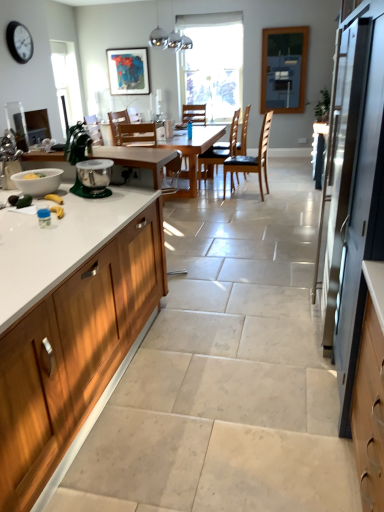
This screenshot has height=512, width=384. Describe the element at coordinates (244, 134) in the screenshot. I see `wooden chair at center, the second chair in the back-to-front sequence` at that location.

In order to face brown leather chair at center, the fourth chair viewed from the back, should I rotate leftwards or rightwards?

You should look right and rotate roughly 7.357 degrees.

I want to click on matte plastic picture frame at upper center, so click(128, 71).

Describe the element at coordinates (128, 71) in the screenshot. I see `matte plastic picture frame at upper center` at that location.

This screenshot has width=384, height=512. I want to click on wooden chair at center, the second chair in the back-to-front sequence, so click(244, 134).

How different are the orientations of wooden chair at center, the second chair in the back-to-front sequence, and satin silver refrigerator at right in degrees?

2 degrees.

Based on the photo, from the image's perspective, between wooden chair at center, the second chair in the back-to-front sequence, and satin silver refrigerator at right, who is located below?

satin silver refrigerator at right.

How much distance is there between wooden chair at center, which ranks as the fourth chair in front-to-back order, and satin silver refrigerator at right?

wooden chair at center, which ranks as the fourth chair in front-to-back order, is 4.15 meters away from satin silver refrigerator at right.

I want to click on the 4th chair behind the satin silver refrigerator at right, counting from the anchor's position, so click(x=244, y=134).

Is green plastic stand mixer at left in front of or behind matte plastic picture frame at upper center in the image?

In the image, green plastic stand mixer at left appears in front of matte plastic picture frame at upper center.

Between green plastic stand mixer at left and matte plastic picture frame at upper center, which one has smaller size?

With smaller size is matte plastic picture frame at upper center.

Is matte plastic picture frame at upper center at the back of green plastic stand mixer at left?

That's not correct — green plastic stand mixer at left is not looking away from matte plastic picture frame at upper center.

Considering the relative sizes of wooden cabinet at left and matte plastic picture frame at upper center in the image provided, is wooden cabinet at left shorter than matte plastic picture frame at upper center?

In fact, wooden cabinet at left may be taller than matte plastic picture frame at upper center.

Is wooden cabinet at left thinner than matte plastic picture frame at upper center?

No.

Is wooden cabinet at left looking in the opposite direction of matte plastic picture frame at upper center?

Yes, wooden cabinet at left's orientation is away from matte plastic picture frame at upper center.

Does wooden chair at center, which is the first chair in front-to-back order, have a greater width compared to light wood table at center?

No, wooden chair at center, which is the first chair in front-to-back order, is not wider than light wood table at center.

From the picture: Is wooden chair at center, the fifth chair when ordered from back to front, smaller than light wood table at center?

Yes.

Is wooden chair at center, which is the first chair in front-to-back order, with light wood table at center?

There is a gap between wooden chair at center, which is the first chair in front-to-back order, and light wood table at center.

In order to click on the 2nd chair below the wooden chair at center, which is counted as the 3th chair, starting from the back (from the image's perspective) in this screenshot , I will do `click(146, 150)`.

From the image's perspective, is wooden chair at center, which is counted as the 3th chair, starting from the front, located above wooden chair at center, which is the first chair in front-to-back order?

Yes, from the image's perspective, wooden chair at center, which is counted as the 3th chair, starting from the front, is over wooden chair at center, which is the first chair in front-to-back order.

Considering the relative positions of wooden chair at center, which is counted as the 3th chair, starting from the front, and wooden chair at center, which is the first chair in front-to-back order, in the image provided, is wooden chair at center, which is counted as the 3th chair, starting from the front, to the left or to the right of wooden chair at center, which is the first chair in front-to-back order,?

In the image, wooden chair at center, which is counted as the 3th chair, starting from the front, appears on the right side of wooden chair at center, which is the first chair in front-to-back order.

In the image, is wooden chair at center, which ranks as the fourth chair in front-to-back order, positioned in front of or behind transparent glass window at center?

wooden chair at center, which ranks as the fourth chair in front-to-back order, is in front of transparent glass window at center.

Does wooden chair at center, which ranks as the fourth chair in front-to-back order, have a lesser width compared to transparent glass window at center?

Incorrect, the width of wooden chair at center, which ranks as the fourth chair in front-to-back order, is not less than that of transparent glass window at center.

Does wooden chair at center, the second chair in the back-to-front sequence, turn towards transparent glass window at center?

No, wooden chair at center, the second chair in the back-to-front sequence, is not aimed at transparent glass window at center.

How distant is wooden chair at center, the second chair in the back-to-front sequence, from transparent glass window at center?

36.86 inches.

Find the location of a particular element. table lying on the left of transparent glass window at center is located at coordinates (192, 153).

Is light wood table at center inside transparent glass window at center?

No, light wood table at center is not inside transparent glass window at center.

Looking at this image, how different are the orientations of transparent glass window at center and light wood table at center in degrees?

transparent glass window at center and light wood table at center are facing 0.36 degrees away from each other.

Is transparent glass window at center taller or shorter than light wood table at center?

Considering their sizes, transparent glass window at center has more height than light wood table at center.

From the image's perspective, starting from the satin silver refrigerator at right, which chair is the 4th one above? Please provide its 2D coordinates.

[(244, 134)]

The image size is (384, 512). I want to click on picture frame to the left of green plastic stand mixer at left, so click(x=128, y=71).

Which object lies further to the anchor point clear glass window screen at upper right, wooden cabinet at left or satin silver refrigerator at right?

Based on the image, wooden cabinet at left appears to be further to clear glass window screen at upper right.

Looking at the image, which one is located further to wooden chair at center, which is the first chair in front-to-back order, clear glass window screen at upper right or wooden chair at center, which ranks as the fourth chair in front-to-back order?

Based on the image, clear glass window screen at upper right appears to be further to wooden chair at center, which is the first chair in front-to-back order.

Estimate the real-world distances between objects in this image. Which object is further from light wood table at center, black plastic clock at upper left or wooden chair at center, arranged as the 5th chair when viewed from the front?

black plastic clock at upper left lies further to light wood table at center than the other object.

Estimate the real-world distances between objects in this image. Which object is closer to wooden cabinet at left, satin silver refrigerator at right or brown leather chair at center, the fourth chair viewed from the back?

The object closer to wooden cabinet at left is satin silver refrigerator at right.

Which object lies nearer to the anchor point green plastic stand mixer at left, wooden chair at center, which is the first chair in front-to-back order, or black plastic clock at upper left?

wooden chair at center, which is the first chair in front-to-back order.

Estimate the real-world distances between objects in this image. Which object is further from black plastic clock at upper left, brown leather chair at center, arranged as the 2th chair when viewed from the front, or wooden chair at center, the first chair positioned from the back?

brown leather chair at center, arranged as the 2th chair when viewed from the front, lies further to black plastic clock at upper left than the other object.

Estimate the real-world distances between objects in this image. Which object is closer to satin silver refrigerator at right, white glossy bowl at left or light wood table at center?

white glossy bowl at left lies closer to satin silver refrigerator at right than the other object.

Based on their spatial positions, is wooden chair at center, the first chair positioned from the back, or matte plastic picture frame at upper center closer to brown leather chair at center, arranged as the 2th chair when viewed from the front?

Among the two, wooden chair at center, the first chair positioned from the back, is located nearer to brown leather chair at center, arranged as the 2th chair when viewed from the front.

I want to click on window between black plastic clock at upper left and clear glass window screen at upper right in the horizontal direction, so click(x=212, y=63).

You are a GUI agent. You are given a task and a screenshot of the screen. Output one action in this format:
    pyautogui.click(x=<x>, y=<y>)
    Task: Click on the picture frame between black plastic clock at upper left and wooden chair at center, which ranks as the fourth chair in front-to-back order, from left to right
    This screenshot has height=512, width=384.
    Given the screenshot: What is the action you would take?
    pyautogui.click(x=128, y=71)

Find the location of a particular element. appliance between satin silver refrigerator at right and wooden chair at center, arranged as the 5th chair when viewed from the front, from front to back is located at coordinates (77, 143).

Find the location of a particular element. The height and width of the screenshot is (512, 384). table between wooden cabinet at left and wooden chair at center, which is counted as the 3th chair, starting from the front, from front to back is located at coordinates (192, 153).